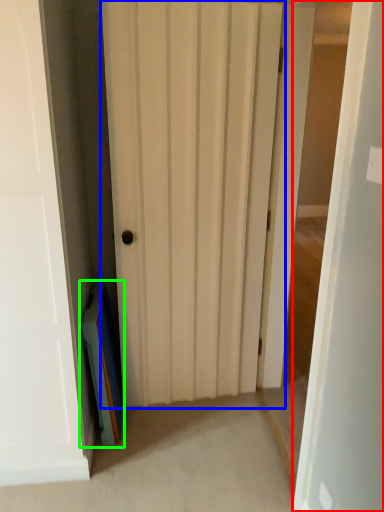
Question: Which object is the farthest from door (highlighted by a red box)? Choose among these: door (highlighted by a blue box) or book (highlighted by a green box).

Choices:
 (A) door
 (B) book

Answer: (B)